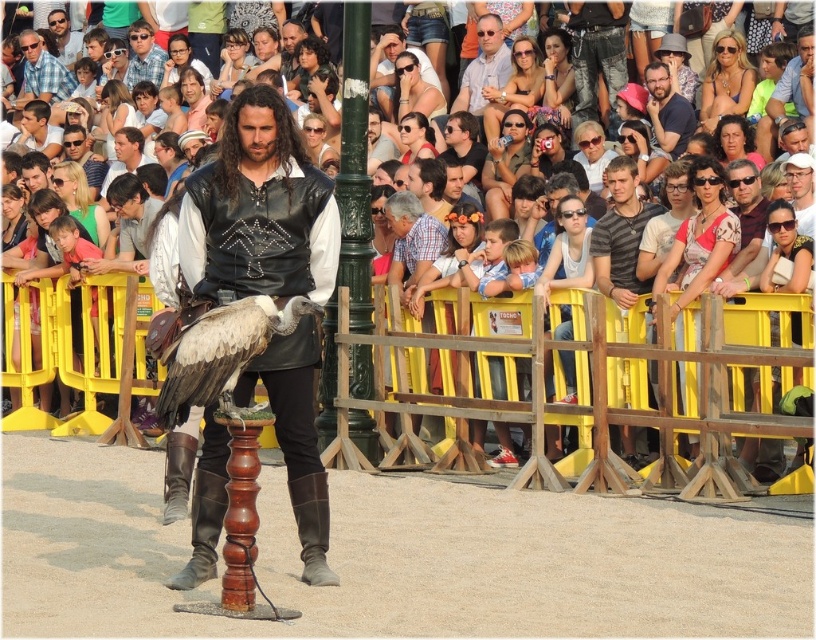
You are a photographer standing at the edge of the crowd. You want to take a photo of the white feathered eagle at center and the matte blue shirt at upper right in the same frame. Considering the distance between them, will you need to zoom out your camera lens to capture both subjects in the frame?

The distance between the white feathered eagle at center and the matte blue shirt at upper right is 16.95 meters, so you will need to zoom out your camera lens to capture both subjects in the same frame.

You are a photographer at the event and want to capture a photo of the white feathered eagle at center and the plaid shirt at center. Based on their positions, which object is closer to the camera?

The white feathered eagle at center is below the plaid shirt at center, so the plaid shirt at center is closer to the camera.